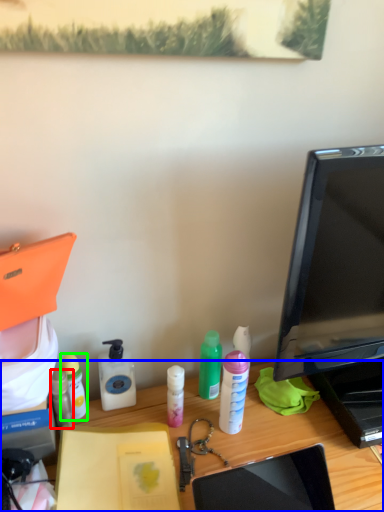
Question: Considering the real-world distances, which object is closest to bottle (highlighted by a red box)? desk (highlighted by a blue box) or bottle (highlighted by a green box).

Choices:
 (A) desk
 (B) bottle

Answer: (B)